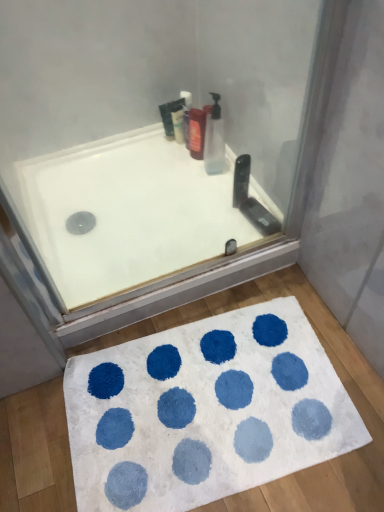
Locate an element on the screen. The height and width of the screenshot is (512, 384). vacant space to the left of shiny plastic soap dispenser at upper center is located at coordinates (161, 159).